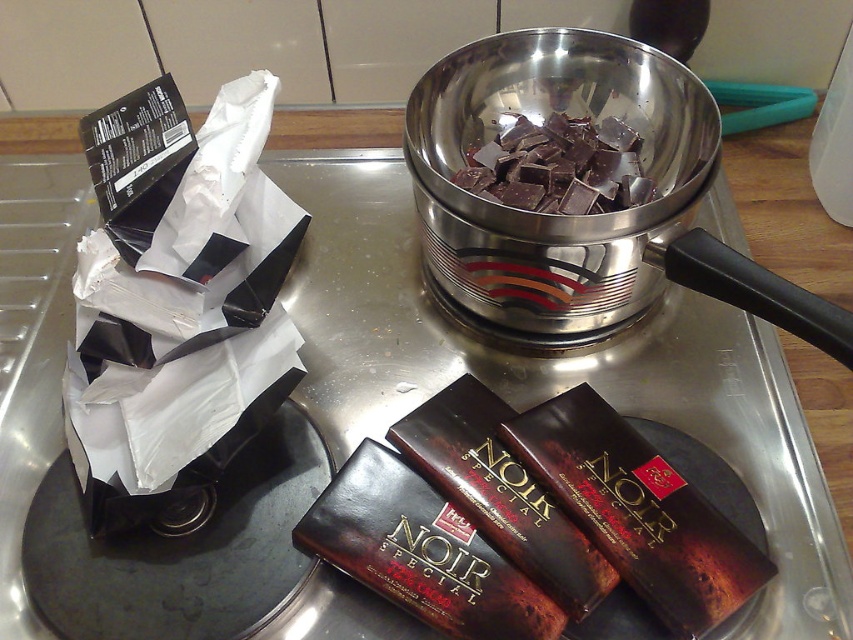
Question: Which point is farther to the camera?

Choices:
 (A) shiny dark brown chocolate bar at lower center
 (B) dark brown matte chocolate bar at lower center

Answer: (B)

Question: Is shiny dark brown chocolate bar at lower center to the right of dark chocolate chunks at center from the viewer's perspective?

Choices:
 (A) yes
 (B) no

Answer: (B)

Question: Does dark brown glossy chocolate bar at lower center have a larger size compared to dark chocolate chunks at center?

Choices:
 (A) no
 (B) yes

Answer: (B)

Question: Is shiny dark brown chocolate bar at lower center to the left of dark chocolate chunks at center from the viewer's perspective?

Choices:
 (A) yes
 (B) no

Answer: (A)

Question: Among these objects, which one is nearest to the camera?

Choices:
 (A) shiny metallic bowl at center
 (B) dark chocolate chunks at center

Answer: (A)

Question: Which of the following is the farthest from the observer?

Choices:
 (A) dark brown glossy chocolate bar at lower center
 (B) shiny dark brown chocolate bar at lower center
 (C) dark brown matte chocolate bar at lower center

Answer: (C)